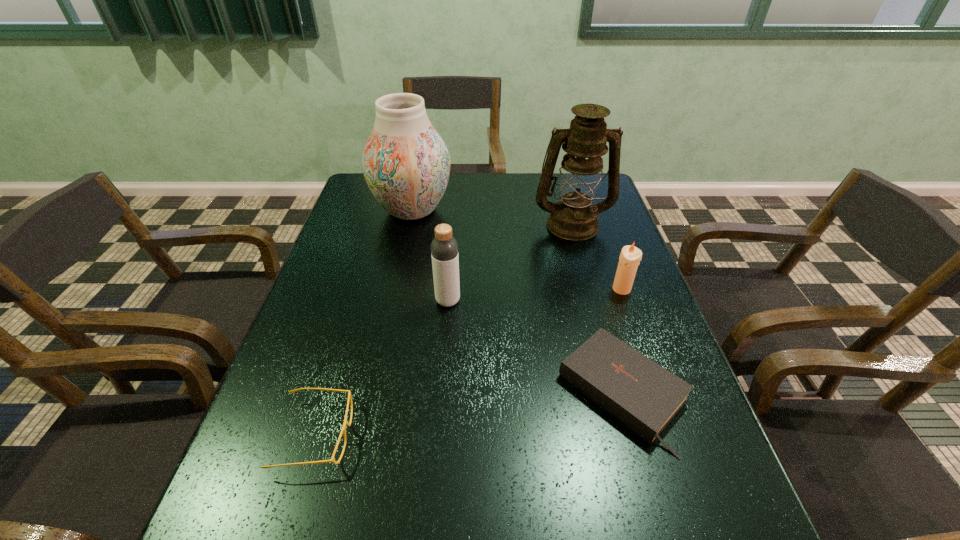
In the image, there is a desktop. Where is `vacant space at the left edge`? Image resolution: width=960 pixels, height=540 pixels. vacant space at the left edge is located at coordinates (338, 366).

In order to click on vacant space at the right edge of the desktop in this screenshot , I will do `click(686, 521)`.

Where is `vacant space that is in between the fourth shortest object and the spectacles`? The width and height of the screenshot is (960, 540). vacant space that is in between the fourth shortest object and the spectacles is located at coordinates (381, 368).

At what (x,y) coordinates should I click in order to perform the action: click on free spot between the Bible and the third tallest object. Please return your answer as a coordinate pair (x, y). The image size is (960, 540). Looking at the image, I should click on (536, 347).

Locate an element on the screen. The width and height of the screenshot is (960, 540). vacant space in between the candle and the oil lamp is located at coordinates (597, 256).

Locate an element on the screen. The height and width of the screenshot is (540, 960). free space between the candle and the oil lamp is located at coordinates (597, 256).

This screenshot has height=540, width=960. I want to click on free space that is in between the Bible and the spectacles, so click(468, 414).

Image resolution: width=960 pixels, height=540 pixels. I want to click on empty space that is in between the oil lamp and the spectacles, so click(x=444, y=329).

Locate an element on the screen. Image resolution: width=960 pixels, height=540 pixels. empty location between the oil lamp and the Bible is located at coordinates pyautogui.click(x=597, y=309).

Where is `blank region between the bottle and the spectacles`? blank region between the bottle and the spectacles is located at coordinates (381, 368).